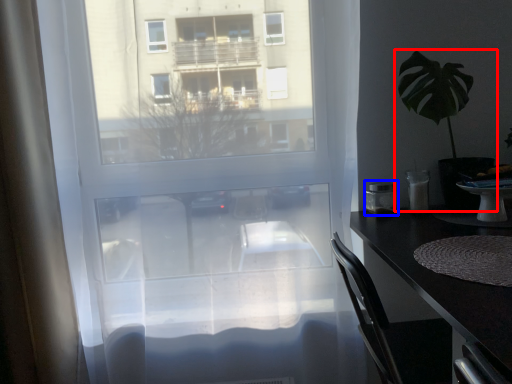
Question: Which object is further to the camera taking this photo, houseplant (highlighted by a red box) or appliance (highlighted by a blue box)?

Choices:
 (A) houseplant
 (B) appliance

Answer: (B)